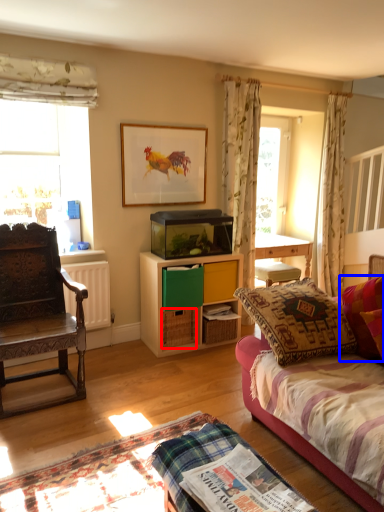
Question: Which of the following is the closest to the observer, drawer (highlighted by a red box) or pillow (highlighted by a blue box)?

Choices:
 (A) drawer
 (B) pillow

Answer: (B)